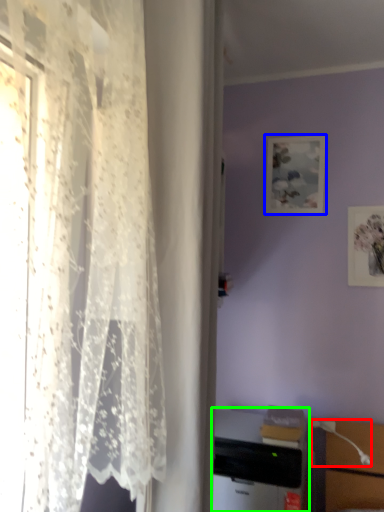
Question: Considering the real-world distances, which object is farthest from table lamp (highlighted by a red box)? picture frame (highlighted by a blue box) or desktop computer (highlighted by a green box)?

Choices:
 (A) picture frame
 (B) desktop computer

Answer: (A)